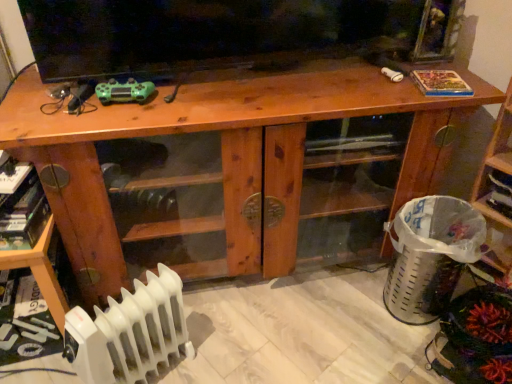
Question: Is wooden shelf at right, acting as the 2th shelf starting from the left, touching wooden shelf at lower left, the 1th shelf from the left?

Choices:
 (A) no
 (B) yes

Answer: (A)

Question: Does wooden shelf at right, acting as the 2th shelf starting from the left, appear on the left side of wooden shelf at lower left, the 1th shelf from the left?

Choices:
 (A) no
 (B) yes

Answer: (A)

Question: Is wooden shelf at lower left, marked as the 2th shelf in a right-to-left arrangement, inside wooden shelf at right, acting as the 2th shelf starting from the left?

Choices:
 (A) yes
 (B) no

Answer: (B)

Question: Is the depth of wooden shelf at right, acting as the 2th shelf starting from the left, less than that of wooden shelf at lower left, the 1th shelf from the left?

Choices:
 (A) no
 (B) yes

Answer: (B)

Question: Is wooden shelf at right, acting as the 2th shelf starting from the left, thinner than wooden shelf at lower left, marked as the 2th shelf in a right-to-left arrangement?

Choices:
 (A) yes
 (B) no

Answer: (A)

Question: Is wooden shelf at right, the 1th shelf viewed from the right, shorter than wooden shelf at lower left, marked as the 2th shelf in a right-to-left arrangement?

Choices:
 (A) yes
 (B) no

Answer: (B)

Question: Can you confirm if green matte controller at upper left is wider than wooden shelf at right, acting as the 2th shelf starting from the left?

Choices:
 (A) yes
 (B) no

Answer: (B)

Question: Does green matte controller at upper left appear on the left side of wooden shelf at right, the 1th shelf viewed from the right?

Choices:
 (A) no
 (B) yes

Answer: (B)

Question: Does green matte controller at upper left lie behind wooden shelf at right, the 1th shelf viewed from the right?

Choices:
 (A) no
 (B) yes

Answer: (B)

Question: From the image's perspective, would you say green matte controller at upper left is shown under wooden shelf at right, the 1th shelf viewed from the right?

Choices:
 (A) yes
 (B) no

Answer: (B)

Question: Does green matte controller at upper left turn towards wooden shelf at right, the 1th shelf viewed from the right?

Choices:
 (A) yes
 (B) no

Answer: (B)

Question: From a real-world perspective, does green matte controller at upper left stand above wooden shelf at right, the 1th shelf viewed from the right?

Choices:
 (A) no
 (B) yes

Answer: (B)

Question: From the image's perspective, would you say wooden cabinet at center is shown under green matte controller at upper left?

Choices:
 (A) no
 (B) yes

Answer: (B)